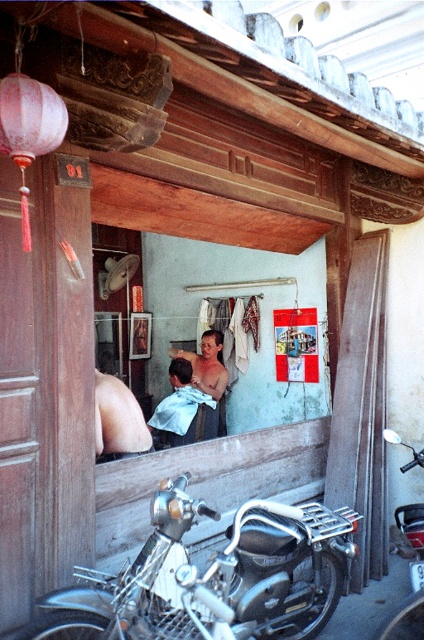
Between point (404, 506) and point (220, 332), which one is positioned in front?

Point (404, 506) is more forward.

Is shiny chrome motorcycle at lower right thinner than shiny metallic hairdryer at center?

Yes, shiny chrome motorcycle at lower right is thinner than shiny metallic hairdryer at center.

Identify the location of shiny chrome motorcycle at lower right. The height and width of the screenshot is (640, 424). (410, 579).

Is light blue fabric at center bigger than shiny chrome motorcycle at lower right?

Yes.

What do you see at coordinates (183, 410) in the screenshot? I see `light blue fabric at center` at bounding box center [183, 410].

Where is `light blue fabric at center`? The image size is (424, 640). light blue fabric at center is located at coordinates (183, 410).

Locate an element on the screen. The height and width of the screenshot is (640, 424). light blue fabric at center is located at coordinates (183, 410).

Looking at this image, is shiny chrome motorcycle at lower left bigger than shiny metallic hairdryer at center?

Yes, shiny chrome motorcycle at lower left is bigger than shiny metallic hairdryer at center.

Which is below, shiny chrome motorcycle at lower left or shiny metallic hairdryer at center?

shiny chrome motorcycle at lower left is below.

Who is more distant from viewer, (325, 611) or (222, 388)?

Positioned behind is point (222, 388).

The image size is (424, 640). What are the coordinates of `shiny chrome motorcycle at lower left` in the screenshot? It's located at (212, 577).